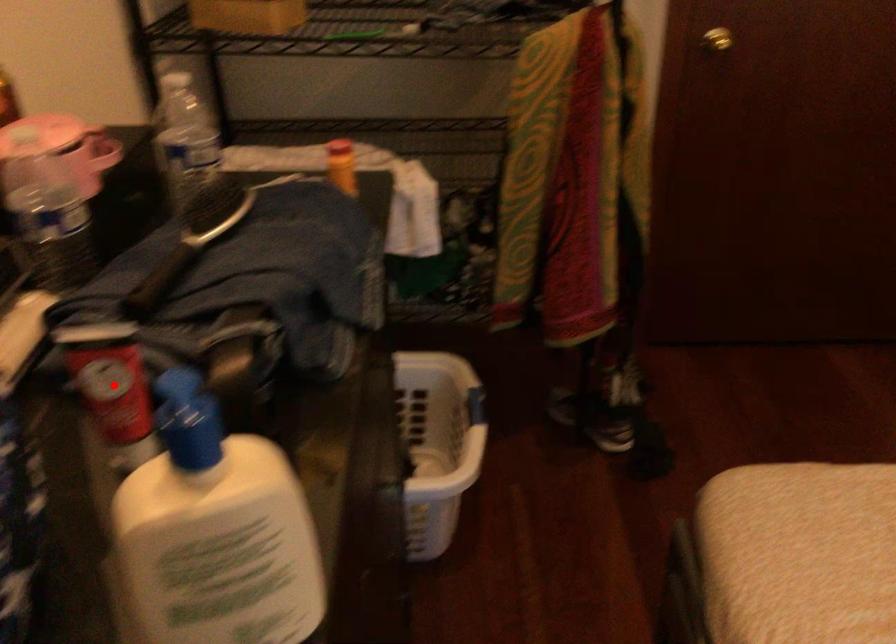
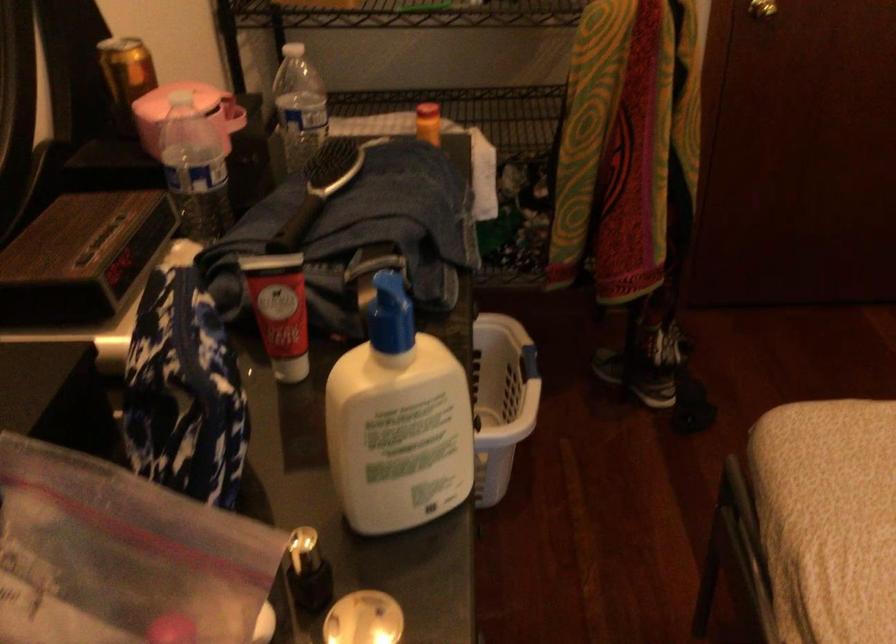
In the second image, find the point that corresponds to the highlighted location in the first image.

(280, 310)